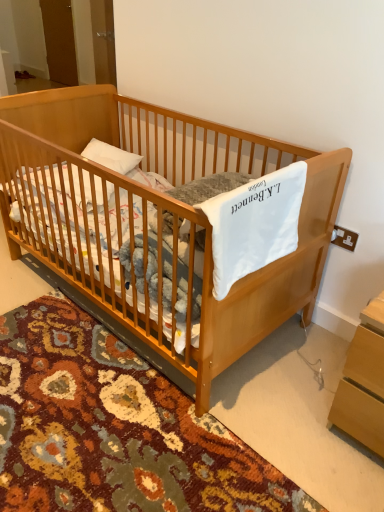
Measure the distance between light brown wooden crib at center and camera.

light brown wooden crib at center and camera are 3.69 feet apart.

Describe the element at coordinates (158, 214) in the screenshot. I see `light brown wooden crib at center` at that location.

I want to click on white soft blanket at center, so click(254, 224).

Measure the distance between white soft blanket at center and light brown wooden changing table at lower right.

white soft blanket at center and light brown wooden changing table at lower right are 17.60 inches apart.

Does white soft blanket at center have a lesser height compared to light brown wooden changing table at lower right?

Yes, white soft blanket at center is shorter than light brown wooden changing table at lower right.

Is white soft blanket at center not close to light brown wooden changing table at lower right?

They are positioned close to each other.

From the image's perspective, does white soft blanket at center appear higher than light brown wooden changing table at lower right?

Indeed, from the image's perspective, white soft blanket at center is shown above light brown wooden changing table at lower right.

From the image's perspective, is light brown wooden changing table at lower right above white soft blanket at center?

No, from the image's perspective, light brown wooden changing table at lower right is not above white soft blanket at center.

Is light brown wooden changing table at lower right in contact with white soft blanket at center?

No, light brown wooden changing table at lower right is not touching white soft blanket at center.

Is light brown wooden changing table at lower right facing towards white soft blanket at center?

No, light brown wooden changing table at lower right is not aimed at white soft blanket at center.

Considering their positions, is light brown wooden crib at center located in front of or behind light brown wooden changing table at lower right?

light brown wooden crib at center is in front of light brown wooden changing table at lower right.

Is light brown wooden crib at center in contact with light brown wooden changing table at lower right?

There is a gap between light brown wooden crib at center and light brown wooden changing table at lower right.

Does light brown wooden crib at center appear on the left side of light brown wooden changing table at lower right?

Indeed, light brown wooden crib at center is positioned on the left side of light brown wooden changing table at lower right.

Which point is more distant from viewer, (88, 213) or (236, 272)?

The point (88, 213) is farther from the camera.

Is light brown wooden crib at center next to white soft blanket at center and touching it?

No, light brown wooden crib at center is not beside white soft blanket at center.

Is light brown wooden crib at center looking in the opposite direction of white soft blanket at center?

No, light brown wooden crib at center is not facing away from white soft blanket at center.

From a real-world perspective, between light brown wooden crib at center and white soft blanket at center, who is vertically lower?

light brown wooden crib at center is physically lower.

Can you confirm if white soft blanket at center is positioned to the left of light brown wooden crib at center?

No, white soft blanket at center is not to the left of light brown wooden crib at center.

Is white soft blanket at center facing away from light brown wooden crib at center?

That's right, white soft blanket at center is facing away from light brown wooden crib at center.

How different are the orientations of white soft blanket at center and light brown wooden crib at center in degrees?

90 degrees.

Measure the distance between white soft blanket at center and light brown wooden crib at center.

white soft blanket at center is 17.33 inches away from light brown wooden crib at center.

Could you tell me if light brown wooden changing table at lower right is turned towards light brown wooden crib at center?

No.

Locate an element on the screen. This screenshot has width=384, height=512. changing table that is below the light brown wooden crib at center (from the image's perspective) is located at coordinates (363, 382).

Would you say light brown wooden changing table at lower right is a long distance from light brown wooden crib at center?

That's not correct — light brown wooden changing table at lower right is a little close to light brown wooden crib at center.

You are a GUI agent. You are given a task and a screenshot of the screen. Output one action in this format:
    pyautogui.click(x=<x>, y=<y>)
    Task: Click on the changing table behind the white soft blanket at center
    The width and height of the screenshot is (384, 512).
    Given the screenshot: What is the action you would take?
    pyautogui.click(x=363, y=382)

The height and width of the screenshot is (512, 384). Find the location of `sheet on the left of light brown wooden changing table at lower right`. sheet on the left of light brown wooden changing table at lower right is located at coordinates (254, 224).

Looking at the image, which one is located further to light brown wooden crib at center, white soft blanket at center or light brown wooden changing table at lower right?

light brown wooden changing table at lower right is further to light brown wooden crib at center.

Considering their positions, is light brown wooden changing table at lower right positioned further to light brown wooden crib at center than white soft blanket at center?

light brown wooden changing table at lower right.

Based on the photo, looking at the image, which one is located further to light brown wooden changing table at lower right, white soft blanket at center or light brown wooden crib at center?

Based on the image, light brown wooden crib at center appears to be further to light brown wooden changing table at lower right.

Which object lies nearer to the anchor point light brown wooden changing table at lower right, light brown wooden crib at center or white soft blanket at center?

The object closer to light brown wooden changing table at lower right is white soft blanket at center.

From the picture: Estimate the real-world distances between objects in this image. Which object is further from white soft blanket at center, light brown wooden changing table at lower right or light brown wooden crib at center?

The object further to white soft blanket at center is light brown wooden changing table at lower right.

Based on their spatial positions, is light brown wooden crib at center or light brown wooden changing table at lower right further from white soft blanket at center?

light brown wooden changing table at lower right is positioned further to the anchor white soft blanket at center.

This screenshot has width=384, height=512. In order to click on sheet between light brown wooden crib at center and light brown wooden changing table at lower right in this screenshot , I will do `click(254, 224)`.